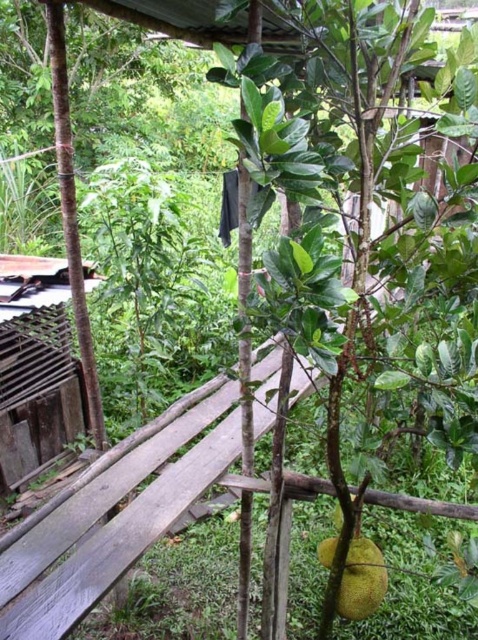
Looking at this image, is weathered wood bench at center closer to the viewer compared to yellow matte jackfruit at center?

Yes, it is.

Is weathered wood bench at center smaller than yellow matte jackfruit at center?

No.

You are a GUI agent. You are given a task and a screenshot of the screen. Output one action in this format:
    pyautogui.click(x=<x>, y=<y>)
    Task: Click on the weathered wood bench at center
    Image resolution: width=478 pixels, height=640 pixels.
    Given the screenshot: What is the action you would take?
    pyautogui.click(x=112, y=516)